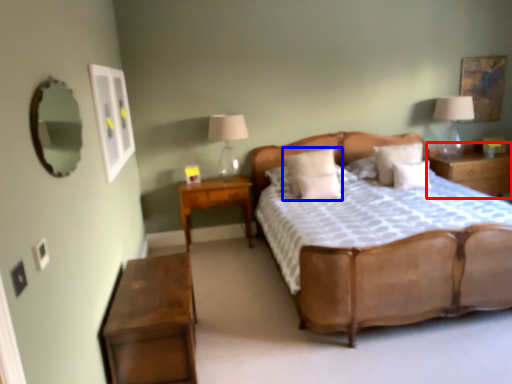
Question: Which point is closer to the camera, nightstand (highlighted by a red box) or pillow (highlighted by a blue box)?

Choices:
 (A) nightstand
 (B) pillow

Answer: (B)